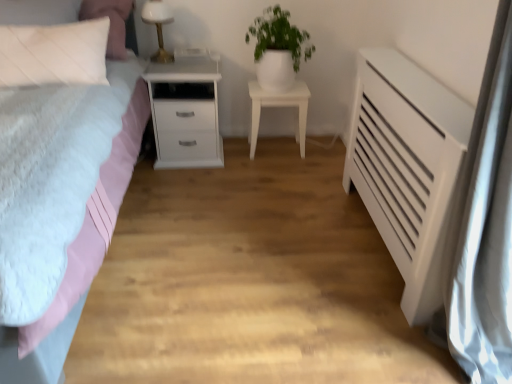
In order to click on free spot below white glossy nightstand at center, acting as the second nightstand starting from the left (from a real-world perspective) in this screenshot , I will do `click(278, 148)`.